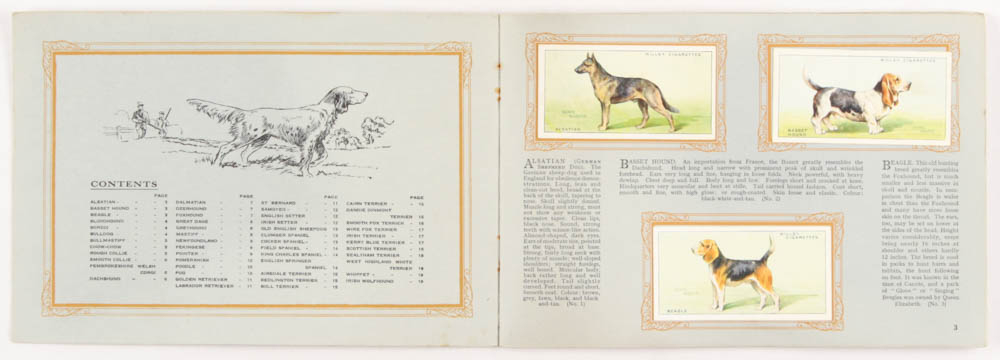
Locate an element on the screen. The height and width of the screenshot is (360, 1000). book is located at coordinates (567, 259).